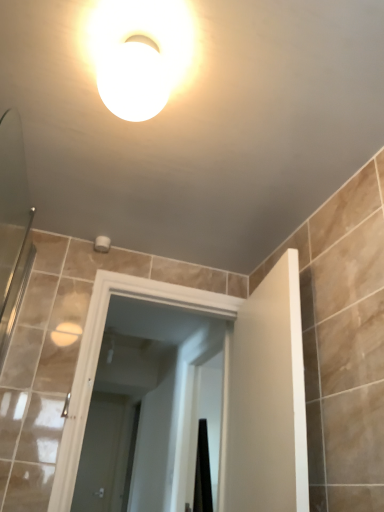
Question: From a real-world perspective, relative to white glossy door at center, marked as the first screen door in a top-to-bottom arrangement, is white glossy light fixture at upper center vertically above or below?

Choices:
 (A) below
 (B) above

Answer: (B)

Question: Is white glossy light fixture at upper center bigger or smaller than white glossy door at center, the 1th screen door when ordered from front to back?

Choices:
 (A) big
 (B) small

Answer: (B)

Question: Which is nearer to the white glossy door at center, which is counted as the 2th screen door, starting from the front?

Choices:
 (A) white glossy door at center, positioned as the 2th screen door in bottom-to-top order
 (B) white glossy light fixture at upper center

Answer: (A)

Question: Which is farther from the white glossy door at center, marked as the 2th screen door in a left-to-right arrangement?

Choices:
 (A) white glossy light fixture at upper center
 (B) white glossy door at center, which is the first screen door in left-to-right order

Answer: (A)